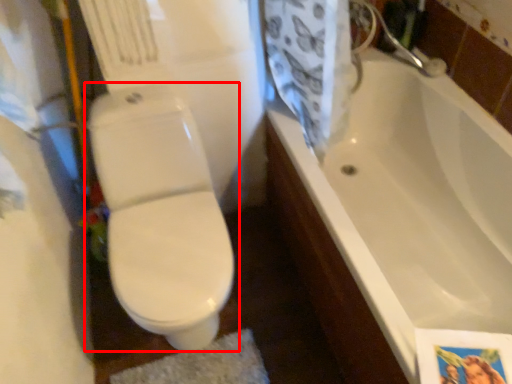
Question: In this image, where is toilet (annotated by the red box) located relative to bathtub?

Choices:
 (A) right
 (B) left

Answer: (B)